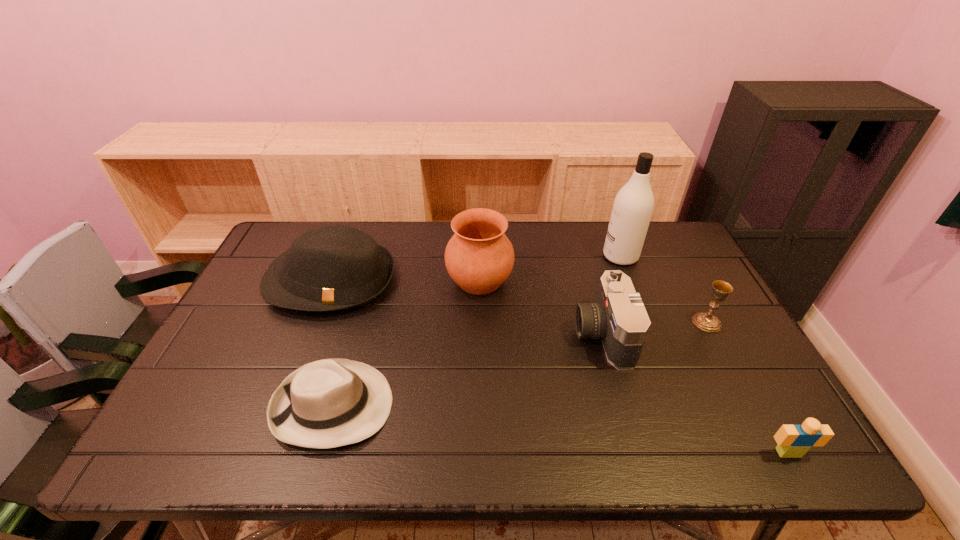
Locate an element on the screen. The width and height of the screenshot is (960, 540). free space at the left edge is located at coordinates (262, 313).

Identify the location of vacant space at the right edge. This screenshot has width=960, height=540. click(723, 334).

The height and width of the screenshot is (540, 960). In the image, there is a desktop. What are the coordinates of `vacant space at the far left corner` in the screenshot? It's located at (304, 226).

Identify the location of free space at the far right corner of the desktop. Image resolution: width=960 pixels, height=540 pixels. (650, 262).

Find the location of a particular element. The width and height of the screenshot is (960, 540). vacant area that lies between the Lego and the shampoo is located at coordinates tap(705, 355).

Identify the location of free space between the Lego and the camera. (695, 394).

Where is `free point between the chalice and the farther fedora`? free point between the chalice and the farther fedora is located at coordinates (519, 301).

Identify the location of vacant space that's between the tallest object and the sixth shortest object. (550, 268).

Where is `free space that is in between the nearer fedora and the shampoo`? The image size is (960, 540). free space that is in between the nearer fedora and the shampoo is located at coordinates (476, 331).

Where is `vacant point located between the farther fedora and the fifth object from right to left`? This screenshot has width=960, height=540. vacant point located between the farther fedora and the fifth object from right to left is located at coordinates (405, 280).